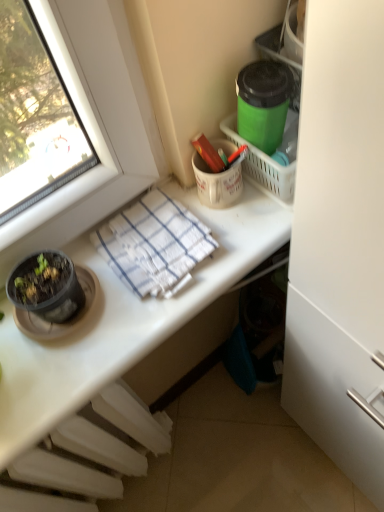
At what (x,y) coordinates should I click in order to perform the action: click on vacant space in front of white woven towel at center. Please return your answer as a coordinate pair (x, y). The width and height of the screenshot is (384, 512). Looking at the image, I should click on (138, 328).